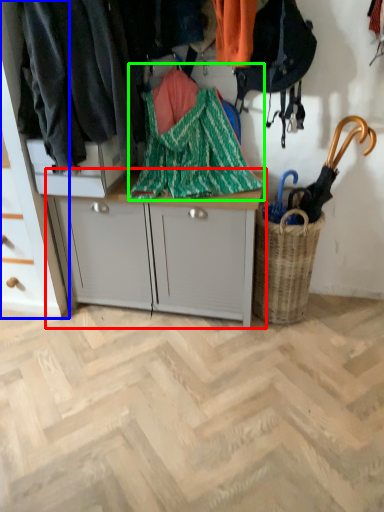
Question: Based on their relative distances, which object is farther from desk (highlighted by a red box)? Choose from cabinetry (highlighted by a blue box) and blanket (highlighted by a green box).

Choices:
 (A) cabinetry
 (B) blanket

Answer: (A)